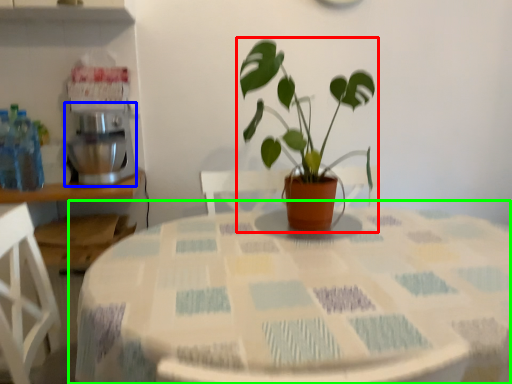
Question: Which object is the farthest from houseplant (highlighted by a red box)? Choose among these: mixer (highlighted by a blue box) or table (highlighted by a green box).

Choices:
 (A) mixer
 (B) table

Answer: (A)